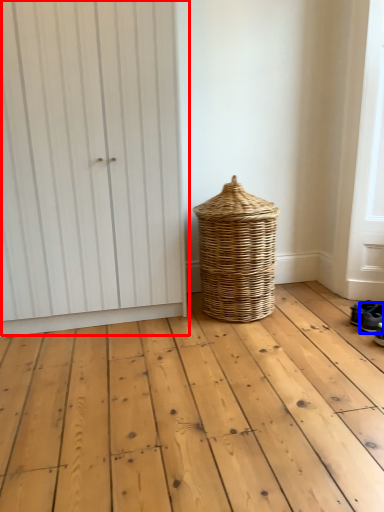
Question: Which point is further to the camera, door (highlighted by a red box) or footwear (highlighted by a blue box)?

Choices:
 (A) door
 (B) footwear

Answer: (B)